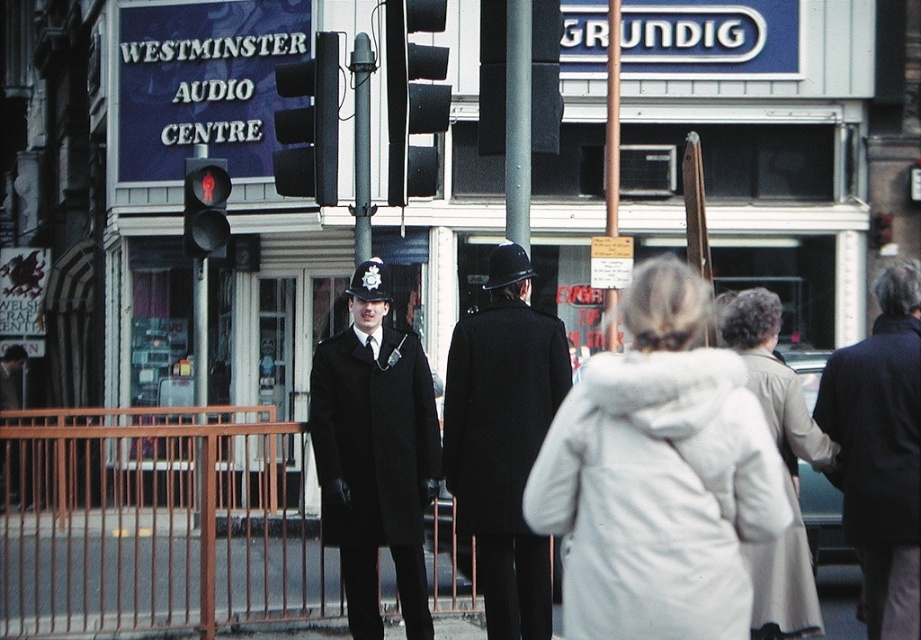
Does black plastic traffic light at center come in front of black plastic traffic light at upper center?

Yes, it is.

Between point (400, 144) and point (334, 161), which one is positioned in front?

Point (334, 161)

Which is in front, point (395, 168) or point (293, 192)?

Positioned in front is point (293, 192).

At what (x,y) coordinates should I click in order to perform the action: click on black plastic traffic light at center. Please return your answer as a coordinate pair (x, y). Image resolution: width=921 pixels, height=640 pixels. Looking at the image, I should click on (414, 97).

Which is more to the left, matte black uniform at center or light beige fabric coat at lower right?

Positioned to the left is matte black uniform at center.

Between point (371, 618) and point (799, 600), which one is positioned in front?

Point (799, 600) is in front.

The image size is (921, 640). I want to click on matte black uniform at center, so click(x=375, y=452).

Does matte black coat at center appear on the left side of light beige fabric coat at lower right?

Correct, you'll find matte black coat at center to the left of light beige fabric coat at lower right.

Which is below, matte black coat at center or light beige fabric coat at lower right?

light beige fabric coat at lower right is below.

The image size is (921, 640). What are the coordinates of `matte black coat at center` in the screenshot? It's located at (503, 440).